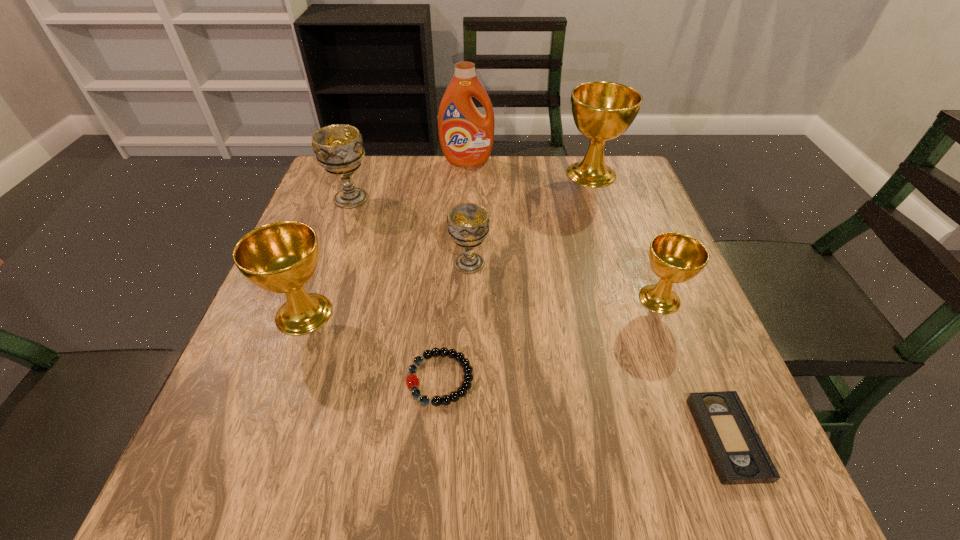
Find the location of `free area in between the nearer white chalice and the second smallest gold chalice`. free area in between the nearer white chalice and the second smallest gold chalice is located at coordinates (387, 288).

Identify the location of the third closest object relative to the smaller white chalice. This screenshot has height=540, width=960. (338, 148).

The height and width of the screenshot is (540, 960). What are the coordinates of `object that ranks as the third closest to the second smallest gold chalice` in the screenshot? It's located at pyautogui.click(x=338, y=148).

Select which chalice appears as the second closest to the left white chalice. Please provide its 2D coordinates. Your answer should be formatted as a tuple, i.e. [(x, y)], where the tuple contains the x and y coordinates of a point satisfying the conditions above.

[(281, 257)]

Locate an element on the screen. This screenshot has height=540, width=960. the third closest chalice relative to the tallest object is located at coordinates (468, 223).

Where is `gold chalice that is the third closest to the left white chalice`? The image size is (960, 540). gold chalice that is the third closest to the left white chalice is located at coordinates (674, 257).

Identify the location of gold chalice that is the second nearest to the videotape. (602, 111).

Locate an element on the screen. The width and height of the screenshot is (960, 540). vacant position in the image that satisfies the following two spatial constraints: 1. on the back side of the right white chalice; 2. on the right side of the black bracelet is located at coordinates (449, 264).